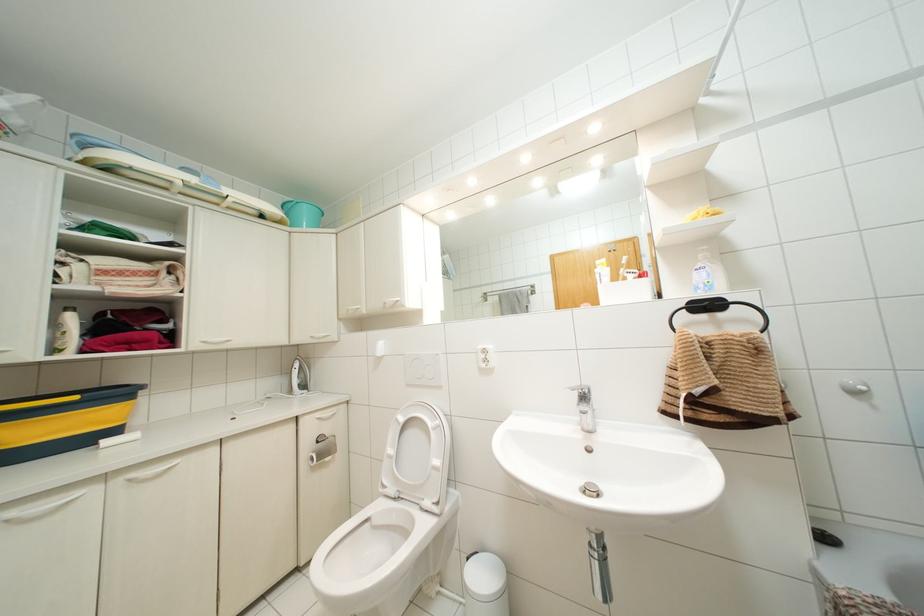
Locate an element on the screen. Image resolution: width=924 pixels, height=616 pixels. trash can pedal is located at coordinates (484, 576).